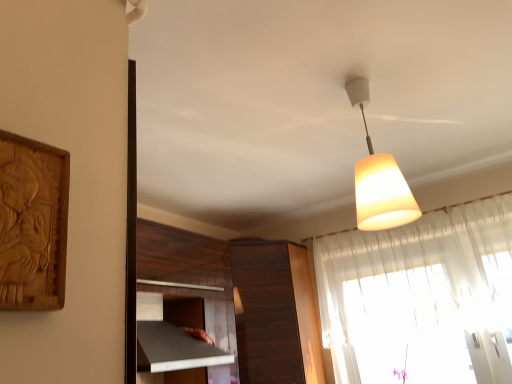
Image resolution: width=512 pixels, height=384 pixels. What do you see at coordinates (275, 313) in the screenshot?
I see `dark wood cabinet at center` at bounding box center [275, 313].

The image size is (512, 384). What are the coordinates of `white matte lampshade at upper center` in the screenshot? It's located at (379, 179).

Image resolution: width=512 pixels, height=384 pixels. I want to click on dark wood cabinet at center, so click(x=275, y=313).

Is dark wood cabinet at center oriented away from translucent fabric curtain at upper right?

No, dark wood cabinet at center is not facing away from translucent fabric curtain at upper right.

From a real-world perspective, relative to translucent fabric curtain at upper right, is dark wood cabinet at center vertically above or below?

dark wood cabinet at center is below translucent fabric curtain at upper right.

Which of these two, dark wood cabinet at center or translucent fabric curtain at upper right, is bigger?

dark wood cabinet at center is bigger.

Between dark wood cabinet at center and translucent fabric curtain at upper right, which one has larger width?

Wider between the two is dark wood cabinet at center.

Can you confirm if translucent fabric curtain at upper right is bigger than white matte lampshade at upper center?

Yes.

Is translucent fabric curtain at upper right turned away from white matte lampshade at upper center?

No, white matte lampshade at upper center is not at the back of translucent fabric curtain at upper right.

Can you confirm if translucent fabric curtain at upper right is taller than white matte lampshade at upper center?

Yes, translucent fabric curtain at upper right is taller than white matte lampshade at upper center.

The image size is (512, 384). I want to click on curtain below the white matte lampshade at upper center (from the image's perspective), so click(418, 296).

Is point (296, 318) closer or farther from the camera than point (358, 206)?

Point (296, 318) appears to be farther away from the viewer than point (358, 206).

The height and width of the screenshot is (384, 512). I want to click on lamp located on the right of dark wood cabinet at center, so click(x=379, y=179).

Is dark wood cabinet at center facing away from white matte lampshade at upper center?

No, white matte lampshade at upper center is not at the back of dark wood cabinet at center.

From a real-world perspective, who is located higher, dark wood cabinet at center or white matte lampshade at upper center?

white matte lampshade at upper center, from a real-world perspective.

Which point is more distant from viewer, (417, 217) or (362, 236)?

The point (362, 236) is more distant.

Which of these two, white matte lampshade at upper center or translucent fabric curtain at upper right, is bigger?

With larger size is translucent fabric curtain at upper right.

From a real-world perspective, is white matte lampshade at upper center physically located above or below translucent fabric curtain at upper right?

white matte lampshade at upper center is above translucent fabric curtain at upper right.

Is white matte lampshade at upper center in front of or behind translucent fabric curtain at upper right in the image?

In the image, white matte lampshade at upper center appears in front of translucent fabric curtain at upper right.

From the image's perspective, which one is positioned higher, white matte lampshade at upper center or dark wood cabinet at center?

white matte lampshade at upper center is shown above in the image.

What's the angular difference between white matte lampshade at upper center and dark wood cabinet at center's facing directions?

The angular difference between white matte lampshade at upper center and dark wood cabinet at center is 171 degrees.

Is dark wood cabinet at center surrounded by white matte lampshade at upper center?

No, dark wood cabinet at center is located outside of white matte lampshade at upper center.

Choose the correct answer: Is translucent fabric curtain at upper right inside dark wood cabinet at center or outside it?

The correct answer is: outside.

Can you tell me how much translucent fabric curtain at upper right and dark wood cabinet at center differ in facing direction?

translucent fabric curtain at upper right and dark wood cabinet at center are facing 90.4 degrees away from each other.

Measure the distance from translucent fabric curtain at upper right to dark wood cabinet at center.

They are 20.18 inches apart.

Locate an element on the screen. The width and height of the screenshot is (512, 384). curtain above the dark wood cabinet at center (from a real-world perspective) is located at coordinates (418, 296).

Find the location of a particular element. cabinetry below the translucent fabric curtain at upper right (from the image's perspective) is located at coordinates (275, 313).

In order to click on lamp above the translucent fabric curtain at upper right (from the image's perspective) in this screenshot , I will do `click(379, 179)`.

Estimate the real-world distances between objects in this image. Which object is further from dark wood cabinet at center, translucent fabric curtain at upper right or white matte lampshade at upper center?

Based on the image, white matte lampshade at upper center appears to be further to dark wood cabinet at center.

From the image, which object appears to be nearer to translucent fabric curtain at upper right, white matte lampshade at upper center or dark wood cabinet at center?

dark wood cabinet at center is positioned closer to the anchor translucent fabric curtain at upper right.

When comparing their distances from white matte lampshade at upper center, does translucent fabric curtain at upper right or dark wood cabinet at center seem closer?

The object closer to white matte lampshade at upper center is translucent fabric curtain at upper right.

From the image, which object appears to be nearer to dark wood cabinet at center, white matte lampshade at upper center or translucent fabric curtain at upper right?

translucent fabric curtain at upper right is positioned closer to the anchor dark wood cabinet at center.

Based on their spatial positions, is dark wood cabinet at center or translucent fabric curtain at upper right further from white matte lampshade at upper center?

dark wood cabinet at center.

Considering their positions, is dark wood cabinet at center positioned further to translucent fabric curtain at upper right than white matte lampshade at upper center?

white matte lampshade at upper center is positioned further to the anchor translucent fabric curtain at upper right.

The width and height of the screenshot is (512, 384). I want to click on curtain between white matte lampshade at upper center and dark wood cabinet at center from front to back, so tap(418, 296).